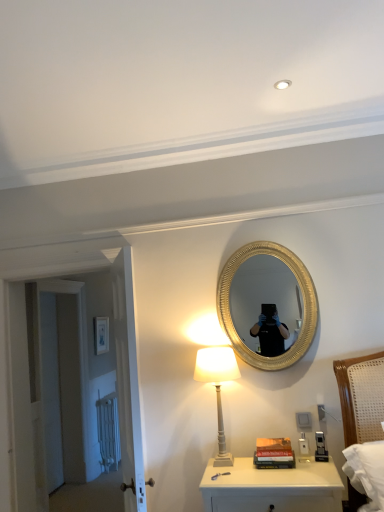
Locate an element on the screen. This screenshot has width=384, height=512. blank space above white glossy nightstand at lower center (from a real-world perspective) is located at coordinates (270, 467).